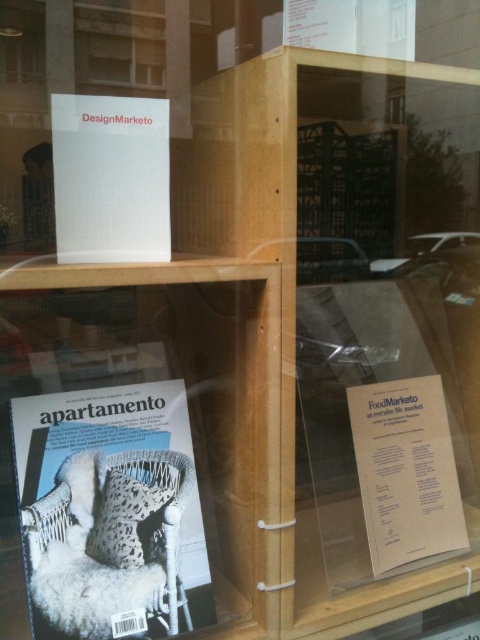
Is white woven chair at lower left above white paper at upper center?

Incorrect, white woven chair at lower left is not positioned above white paper at upper center.

Who is more forward, [73,416] or [85,157]?

Point [85,157]

Where is `white woven chair at lower left`? white woven chair at lower left is located at coordinates (109, 513).